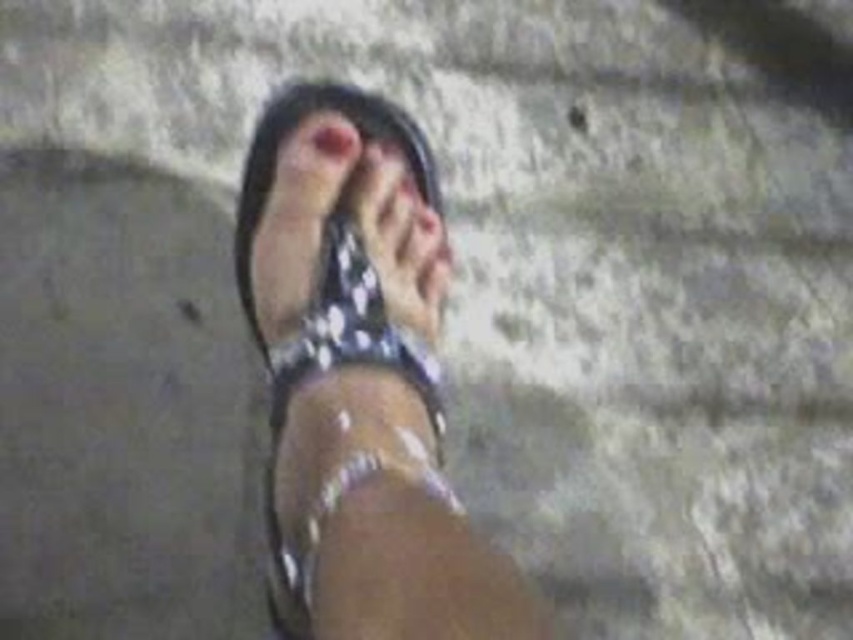
Question: Which point appears farthest from the camera in this image?

Choices:
 (A) (346, 124)
 (B) (340, 522)

Answer: (A)

Question: Which point is closer to the camera taking this photo?

Choices:
 (A) (318, 212)
 (B) (315, 129)

Answer: (A)

Question: Can you confirm if shiny metallic sandal at center is wider than pink matte toe at center?

Choices:
 (A) yes
 (B) no

Answer: (A)

Question: Can you confirm if matte black sandal at center is wider than pink matte toe at center?

Choices:
 (A) no
 (B) yes

Answer: (B)

Question: Which point is closer to the camera taking this photo?

Choices:
 (A) (338, 116)
 (B) (339, 93)
 (C) (325, 317)

Answer: (C)

Question: Where is shiny metallic sandal at center located in relation to pink matte toe at center in the image?

Choices:
 (A) right
 (B) left

Answer: (A)